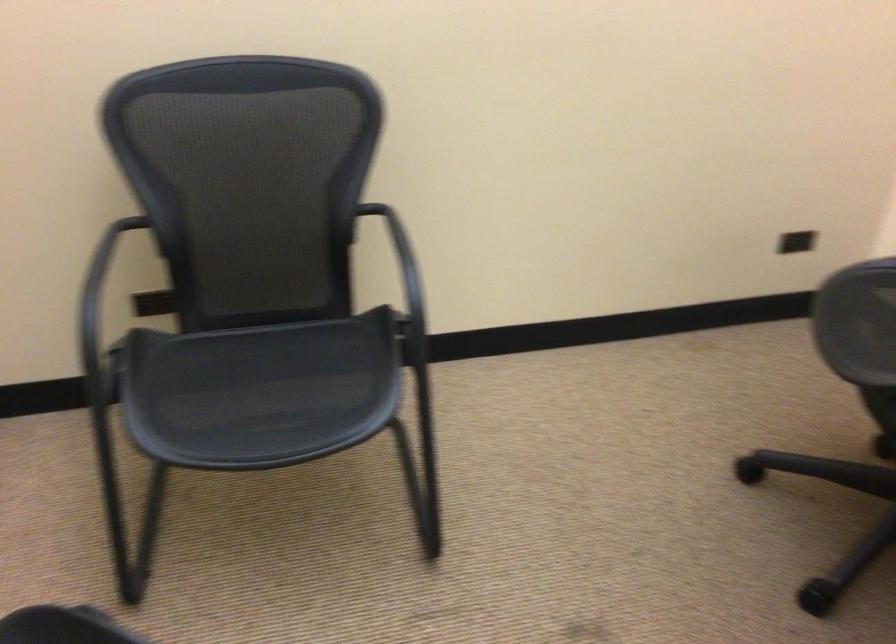
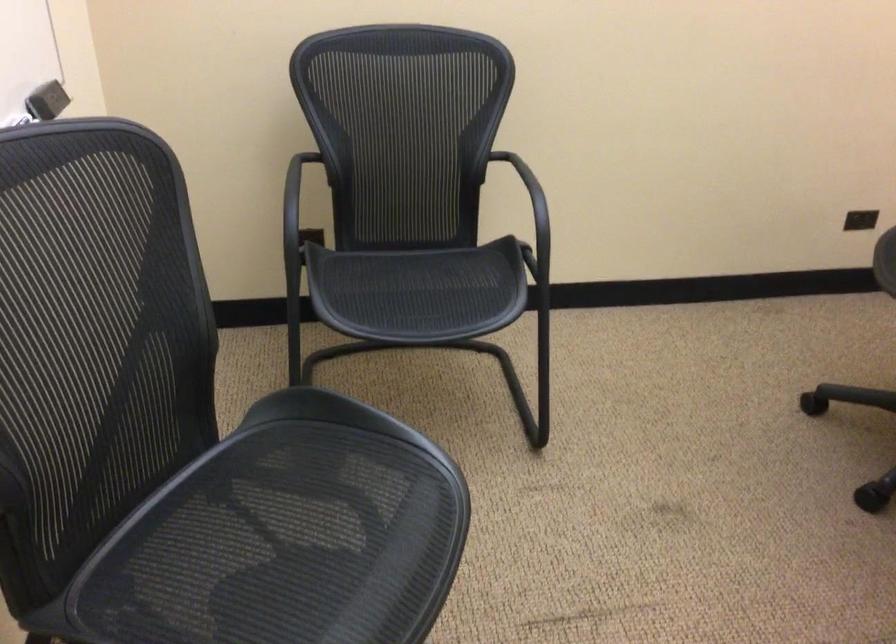
Question: The camera is either moving clockwise (left) or counter-clockwise (right) around the object. The first image is from the beginning of the video and the second image is from the end. Is the camera moving left or right when shooting the video?

Choices:
 (A) Left
 (B) Right

Answer: (B)